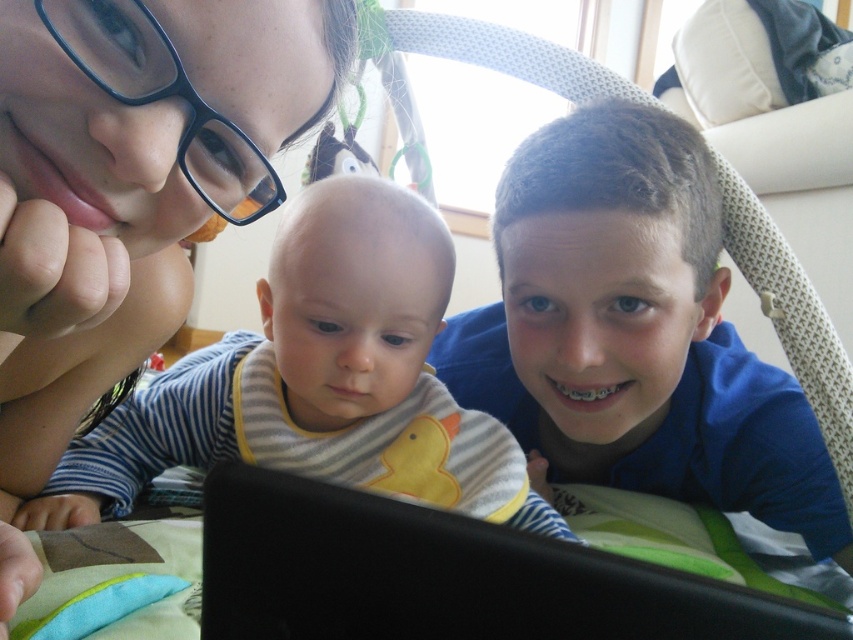
You are a photographer taking a picture of the baby in the striped pajamas. There is a point at coordinate (142,145) in the image. What object is located at that point?

The object at point (142,145) is the matte black glasses at upper left.

You are a photographer trying to capture a candid shot of the baby in the scene. The striped fabric bib at center and the black matte laptop at center are both in the frame. Which object should you focus on to ensure the baby is in sharp focus?

To ensure the baby is in sharp focus, focus on the striped fabric bib at center because it is in front of the black matte laptop at center, which means the baby is closer to the camera than the laptop.

You are a parent trying to decide whether to place the striped fabric bib at center on top of the black matte laptop at center. Based on their sizes, will the bib completely cover the laptop when placed on top?

The striped fabric bib at center is larger in size than the black matte laptop at center, so placing it on top would completely cover the laptop.